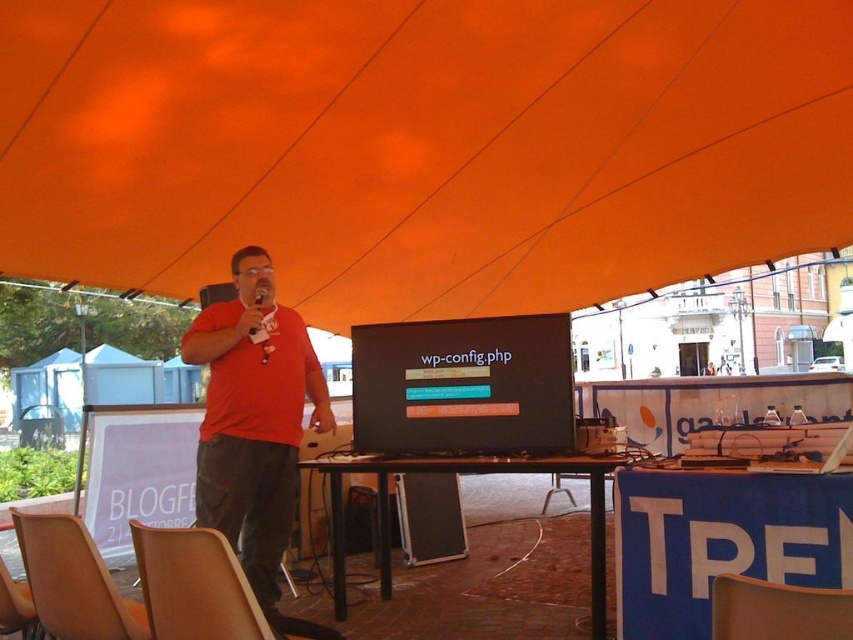
You are an attendee at the event and need to locate the matte black laptop at center. According to the coordinates provided, where should you look on the image?

The matte black laptop at center is located at point coordinates 0.605 on the x axis and 0.544 on the y axis.

In the scene shown: You are an event organizer who needs to set up a new speaker stand. The stand requires a minimum of 5 feet of space between the microphone and the table. Based on the scene, can you confirm if the current setup between the blue fabric table at lower right and the matte black microphone at center meets this requirement?

The blue fabric table at lower right is 6.05 feet from the matte black microphone at center, which exceeds the required 5 feet of space. Therefore, the current setup meets the requirement.